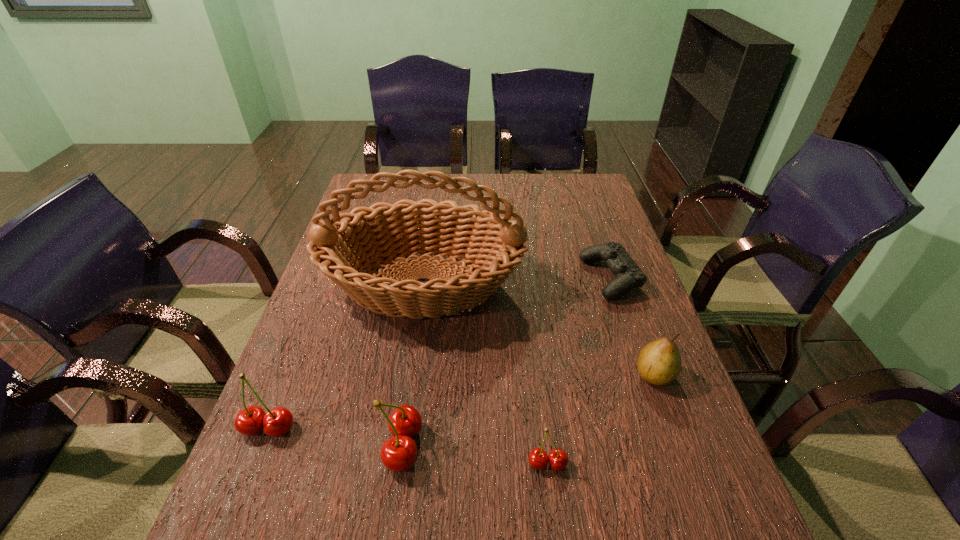
Find the location of a particular element. blank space located 0.140m with the stems of the second cherry from right to left pointing upwards is located at coordinates (492, 445).

This screenshot has height=540, width=960. I want to click on free space located 0.290m on the front of the tallest object, so click(399, 450).

In order to click on blank space located on the left of the control in this screenshot , I will do `click(495, 279)`.

Identify the location of vacant space located on the left of the pear. (599, 374).

You are a GUI agent. You are given a task and a screenshot of the screen. Output one action in this format:
    pyautogui.click(x=<x>, y=<y>)
    Task: Click on the cherry present at the left edge
    
    Given the screenshot: What is the action you would take?
    pyautogui.click(x=251, y=420)

Where is `basket located in the left edge section of the desktop`? The height and width of the screenshot is (540, 960). basket located in the left edge section of the desktop is located at coordinates (390, 231).

This screenshot has width=960, height=540. What are the coordinates of `control at the right edge` in the screenshot? It's located at (628, 275).

The image size is (960, 540). I want to click on pear situated at the right edge, so click(x=659, y=362).

I want to click on vacant space at the far edge, so [495, 186].

The height and width of the screenshot is (540, 960). What are the coordinates of `vacant space at the near edge of the desktop` in the screenshot? It's located at (346, 481).